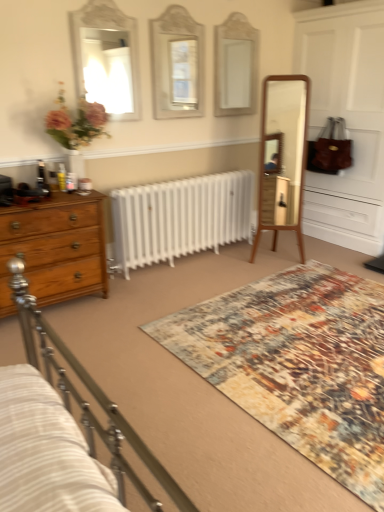
Question: Is white glass mirror at upper center, arranged as the third mirror when viewed from the left, bigger than white glossy mirror at upper left, acting as the third mirror starting from the right?

Choices:
 (A) yes
 (B) no

Answer: (B)

Question: From the image's perspective, does white glass mirror at upper center, which is the first mirror from right to left, appear higher than white glossy mirror at upper left, acting as the third mirror starting from the right?

Choices:
 (A) no
 (B) yes

Answer: (B)

Question: Can you confirm if white glass mirror at upper center, which is the first mirror from right to left, is wider than white glossy mirror at upper left, acting as the third mirror starting from the right?

Choices:
 (A) yes
 (B) no

Answer: (B)

Question: Does white glass mirror at upper center, arranged as the third mirror when viewed from the left, lie in front of white glossy mirror at upper left, the first mirror viewed from the left?

Choices:
 (A) no
 (B) yes

Answer: (A)

Question: Considering the relative positions of white glass mirror at upper center, which is the first mirror from right to left, and white glossy mirror at upper left, acting as the third mirror starting from the right, in the image provided, is white glass mirror at upper center, which is the first mirror from right to left, to the right of white glossy mirror at upper left, acting as the third mirror starting from the right, from the viewer's perspective?

Choices:
 (A) yes
 (B) no

Answer: (A)

Question: Is white glass mirror at upper center, arranged as the third mirror when viewed from the left, taller than white glossy mirror at upper left, acting as the third mirror starting from the right?

Choices:
 (A) no
 (B) yes

Answer: (B)

Question: Considering the relative positions of wooden chest of drawers at left and white glossy mirror at upper left, acting as the third mirror starting from the right, in the image provided, is wooden chest of drawers at left to the left of white glossy mirror at upper left, acting as the third mirror starting from the right, from the viewer's perspective?

Choices:
 (A) yes
 (B) no

Answer: (A)

Question: From a real-world perspective, is wooden chest of drawers at left positioned over white glossy mirror at upper left, the first mirror viewed from the left, based on gravity?

Choices:
 (A) yes
 (B) no

Answer: (B)

Question: Is wooden chest of drawers at left taller than white glossy mirror at upper left, the first mirror viewed from the left?

Choices:
 (A) yes
 (B) no

Answer: (B)

Question: Can you confirm if wooden chest of drawers at left is thinner than white glossy mirror at upper left, the first mirror viewed from the left?

Choices:
 (A) no
 (B) yes

Answer: (A)

Question: Is wooden chest of drawers at left facing towards white glossy mirror at upper left, acting as the third mirror starting from the right?

Choices:
 (A) yes
 (B) no

Answer: (B)

Question: Can you confirm if wooden chest of drawers at left is smaller than white glossy mirror at upper left, acting as the third mirror starting from the right?

Choices:
 (A) yes
 (B) no

Answer: (B)

Question: Can you see white glossy mirror at upper left, the first mirror viewed from the left, touching matte white mirror at center, the second mirror in the left-to-right sequence?

Choices:
 (A) no
 (B) yes

Answer: (A)